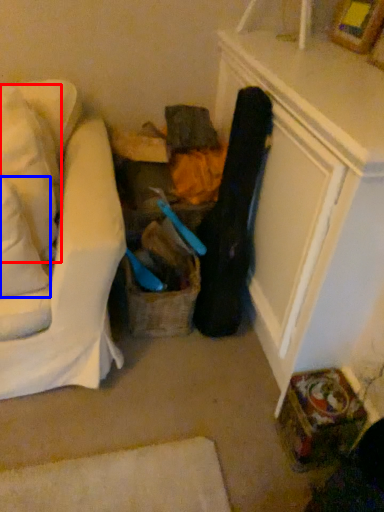
Question: Which object appears farthest to the camera in this image, pillow (highlighted by a red box) or pillow (highlighted by a blue box)?

Choices:
 (A) pillow
 (B) pillow

Answer: (A)